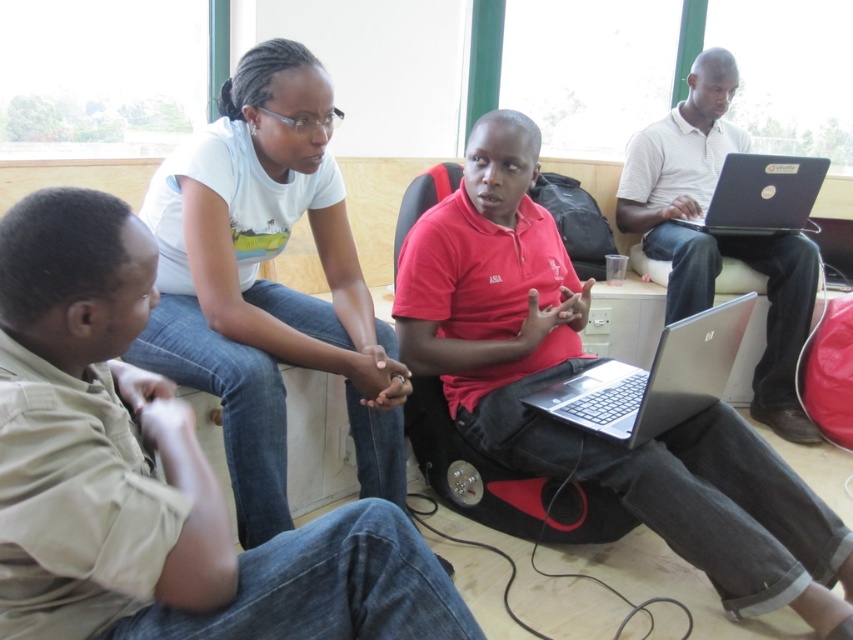
Is point (341, 113) closer to viewer compared to point (698, 236)?

Yes.

What are the coordinates of `white cotton shirt at upper center` in the screenshot? It's located at (267, 284).

You are a GUI agent. You are given a task and a screenshot of the screen. Output one action in this format:
    pyautogui.click(x=<x>, y=<y>)
    Task: Click on the white cotton shirt at upper center
    This screenshot has width=853, height=640.
    Given the screenshot: What is the action you would take?
    pyautogui.click(x=267, y=284)

Between khaki cotton shirt at lower left and black glossy laptop at upper right, which one is positioned lower?

khaki cotton shirt at lower left is below.

Can you confirm if khaki cotton shirt at lower left is thinner than black glossy laptop at upper right?

Incorrect, khaki cotton shirt at lower left's width is not less than black glossy laptop at upper right's.

Identify the location of khaki cotton shirt at lower left. (154, 476).

The width and height of the screenshot is (853, 640). I want to click on khaki cotton shirt at lower left, so click(154, 476).

Does white striped polo shirt at upper right have a smaller size compared to silver metallic laptop at center?

Answer: Actually, white striped polo shirt at upper right might be larger than silver metallic laptop at center.

Does white striped polo shirt at upper right come behind silver metallic laptop at center?

Yes, white striped polo shirt at upper right is further from the viewer.

Where is `white striped polo shirt at upper right`? white striped polo shirt at upper right is located at coordinates (717, 236).

Where is `white striped polo shirt at upper right`? This screenshot has height=640, width=853. white striped polo shirt at upper right is located at coordinates (717, 236).